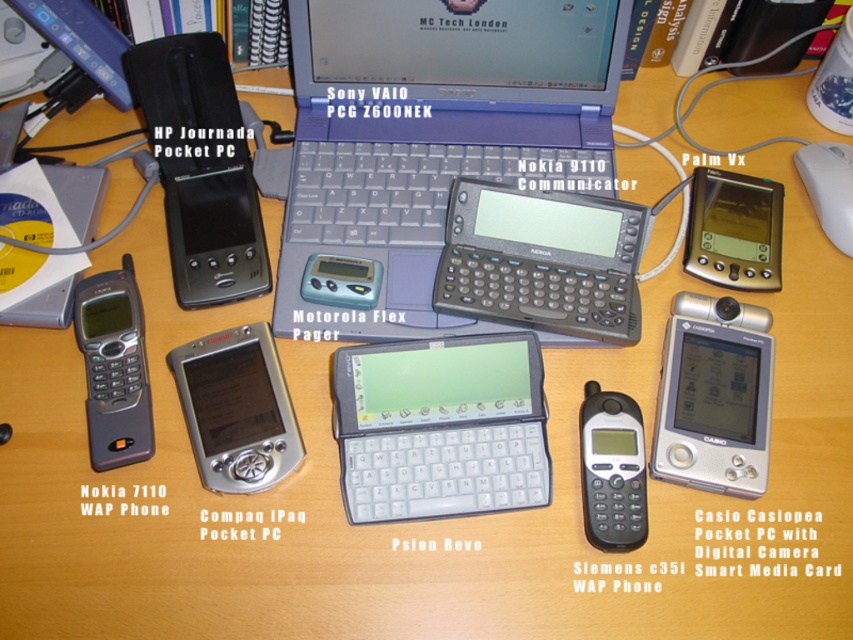
Question: Does white plastic psion revo at center lie in front of black plastic siemens c35i smart media card wap phone at lower right?

Choices:
 (A) yes
 (B) no

Answer: (B)

Question: Among these objects, which one is nearest to the camera?

Choices:
 (A) blue plastic laptop at center
 (B) black plastic hp journda pocket pc at upper left
 (C) silver metallic casio casiopia pocket pc with digital camera at center-right

Answer: (C)

Question: Does silver metallic palm vx at center-right have a greater width compared to black plastic siemens c35i smart media card wap phone at lower right?

Choices:
 (A) yes
 (B) no

Answer: (A)

Question: Based on their relative distances, which object is nearer to the matte black nokia 7110 wap phone at lower left?

Choices:
 (A) black plastic siemens c35i smart media card wap phone at lower right
 (B) silver metallic pocket pc at center

Answer: (B)

Question: Can you confirm if silver metallic casio casiopia pocket pc with digital camera at center-right is positioned above matte black nokia 7110 wap phone at lower left?

Choices:
 (A) no
 (B) yes

Answer: (A)

Question: Which object appears closest to the camera in this image?

Choices:
 (A) black plastic hp journda pocket pc at upper left
 (B) black plastic siemens c35i smart media card wap phone at lower right

Answer: (B)